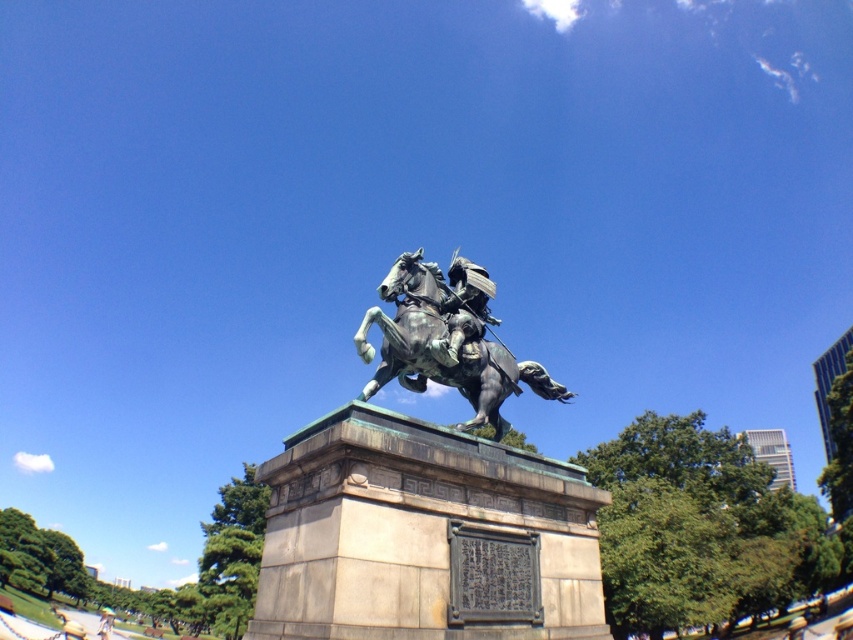
Looking at this image, you are standing in a park and see the green patina statue at center. If you want to take a photo of it from a distance where you can still see the statue clearly but also capture some of the surrounding trees in the background, would 14.05 meters be a suitable distance?

The green patina statue at center is 14.05 meters away from the viewer. At this distance, you can still see the statue clearly and capture the surrounding trees in the background, making it a suitable distance for taking a photo.

You are standing in front of a statue of a mounted figure. You notice two statues here, the green patina statue at center and the bronze statue at center. Which one is nearer to you?

The green patina statue at center is closer to the viewer than the bronze statue at center.